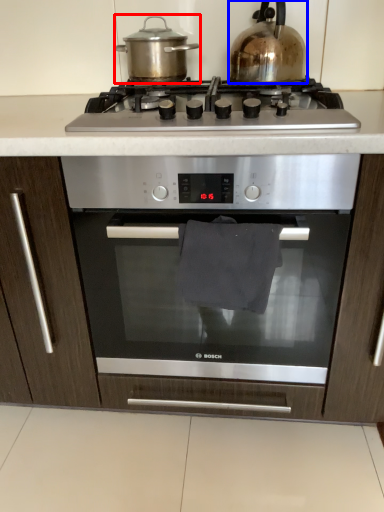
Question: Among these objects, which one is nearest to the camera, kitchen appliance (highlighted by a red box) or kitchen appliance (highlighted by a blue box)?

Choices:
 (A) kitchen appliance
 (B) kitchen appliance

Answer: (B)